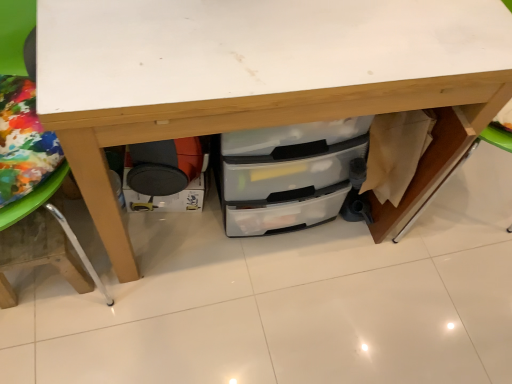
Question: Is the surface of matte black drawer at lower left in direct contact with wooden table leg at lower left?

Choices:
 (A) yes
 (B) no

Answer: (B)

Question: Considering the relative sizes of matte black drawer at lower left and wooden table leg at lower left in the image provided, is matte black drawer at lower left taller than wooden table leg at lower left?

Choices:
 (A) no
 (B) yes

Answer: (A)

Question: Could you tell me if matte black drawer at lower left is facing wooden table leg at lower left?

Choices:
 (A) no
 (B) yes

Answer: (A)

Question: Can you confirm if matte black drawer at lower left is thinner than wooden table leg at lower left?

Choices:
 (A) no
 (B) yes

Answer: (B)

Question: Could wooden table leg at lower left be considered to be inside matte black drawer at lower left?

Choices:
 (A) yes
 (B) no

Answer: (B)

Question: Would you say matte black drawer at lower left is a long distance from wooden table leg at lower left?

Choices:
 (A) no
 (B) yes

Answer: (A)

Question: Is transparent plastic drawers at center oriented towards matte black drawer at lower left?

Choices:
 (A) no
 (B) yes

Answer: (A)

Question: Considering the relative sizes of transparent plastic drawers at center and matte black drawer at lower left in the image provided, is transparent plastic drawers at center smaller than matte black drawer at lower left?

Choices:
 (A) no
 (B) yes

Answer: (A)

Question: Is transparent plastic drawers at center to the right of matte black drawer at lower left from the viewer's perspective?

Choices:
 (A) no
 (B) yes

Answer: (B)

Question: From the image's perspective, is transparent plastic drawers at center above matte black drawer at lower left?

Choices:
 (A) no
 (B) yes

Answer: (B)

Question: Is transparent plastic drawers at center outside of matte black drawer at lower left?

Choices:
 (A) yes
 (B) no

Answer: (A)

Question: Can matte black drawer at lower left be found inside transparent plastic drawers at center?

Choices:
 (A) yes
 (B) no

Answer: (A)

Question: Are wooden table leg at lower left and transparent plastic drawers at center beside each other?

Choices:
 (A) yes
 (B) no

Answer: (B)